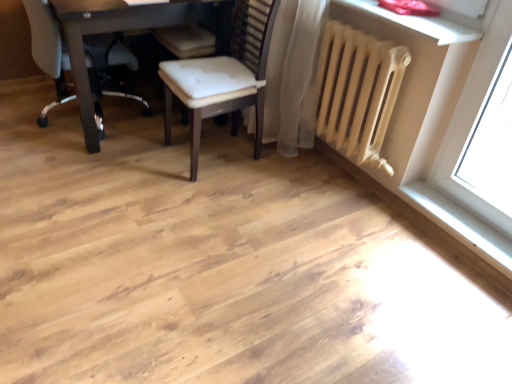
At what (x,y) coordinates should I click in order to perform the action: click on free spot in front of matte dark brown table at upper left. Please return your answer as a coordinate pair (x, y). Looking at the image, I should click on (111, 204).